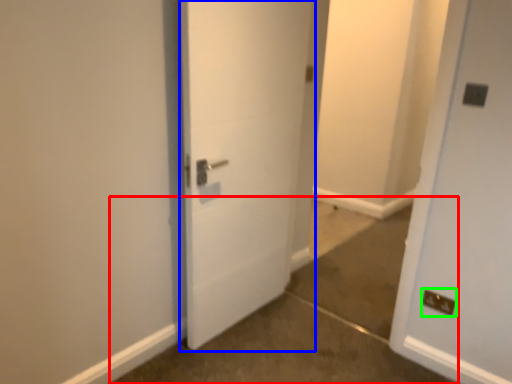
Question: Estimate the real-world distances between objects in this image. Which object is farther from concrete (highlighted by a red box), door (highlighted by a blue box) or electric outlet (highlighted by a green box)?

Choices:
 (A) door
 (B) electric outlet

Answer: (A)